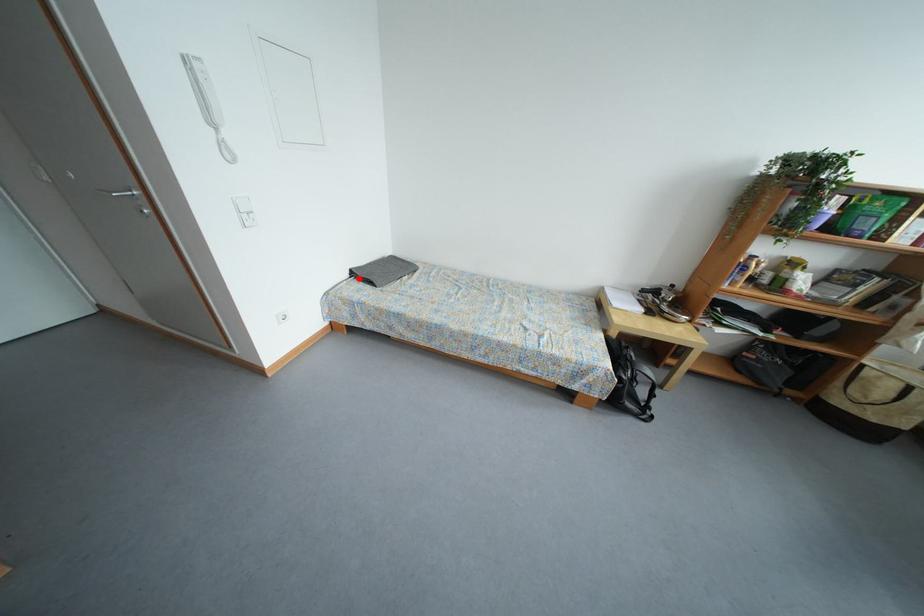
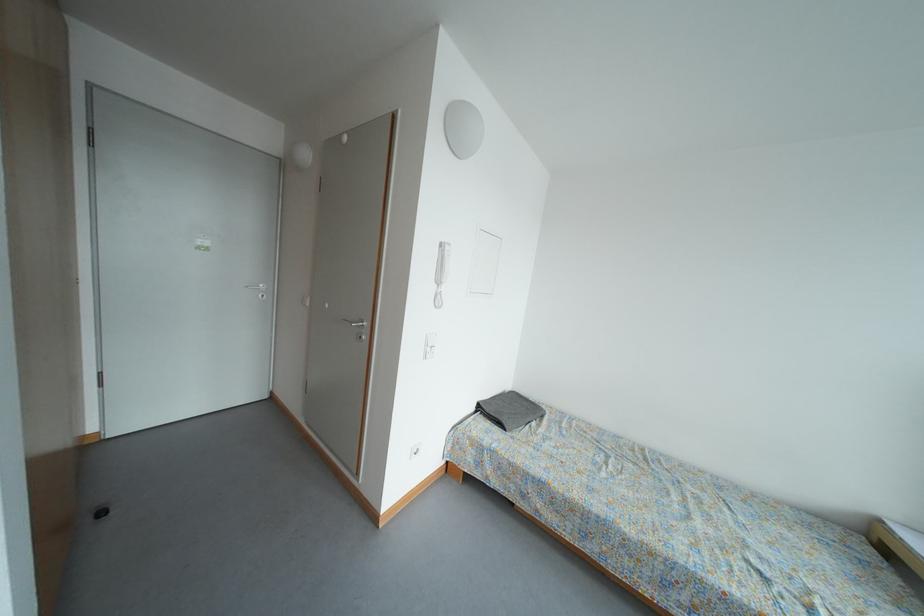
Locate, in the second image, the point that corresponds to the highlighted location in the first image.

(485, 411)